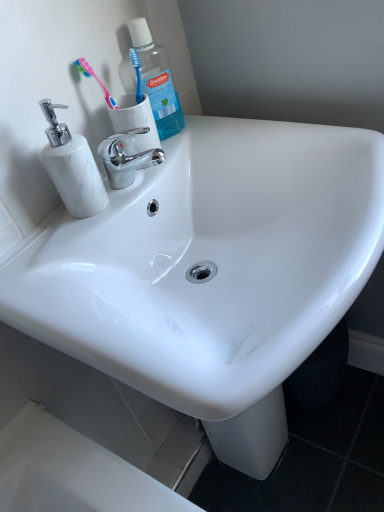
Locate an element on the screen. The width and height of the screenshot is (384, 512). free location in front of white marble soap dispenser at left is located at coordinates (59, 259).